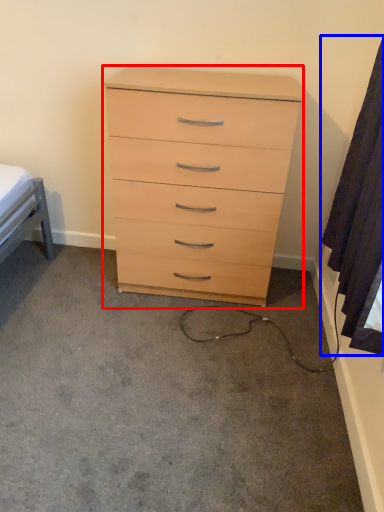
Question: Which object is further to the camera taking this photo, chest of drawers (highlighted by a red box) or curtain (highlighted by a blue box)?

Choices:
 (A) chest of drawers
 (B) curtain

Answer: (A)